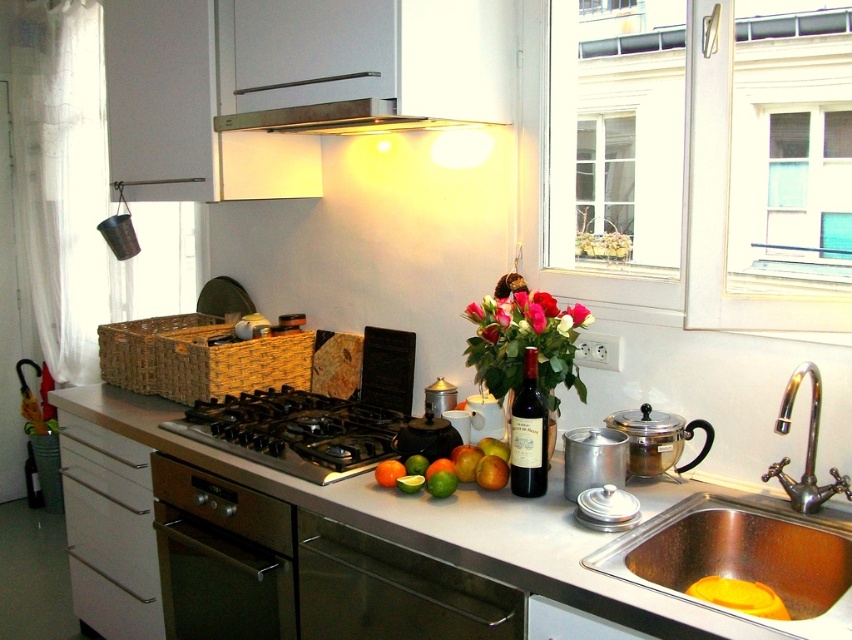
You are organizing items on the kitchen countertop and need to place the green matte lime at center next to the white matte drawer at lower left. Considering their widths, which object is wider and should be placed first to ensure proper spacing?

The white matte drawer at lower left is wider than the green matte lime at center, so it should be placed first to accommodate its larger width.